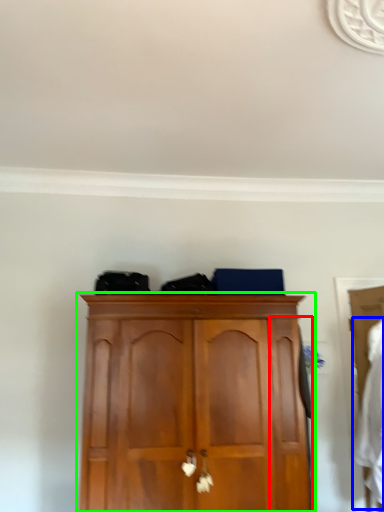
Question: Estimate the real-world distances between objects in this image. Which object is farther from door (highlighted by a red box), clothing (highlighted by a blue box) or cupboard (highlighted by a green box)?

Choices:
 (A) clothing
 (B) cupboard

Answer: (A)